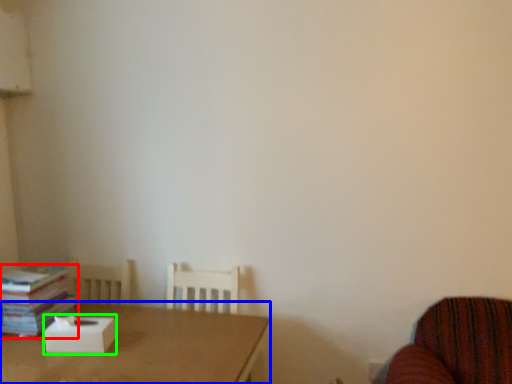
Question: Which is farther away from book (highlighted by a red box)? table (highlighted by a blue box) or cardboard box (highlighted by a green box)?

Choices:
 (A) table
 (B) cardboard box

Answer: (A)